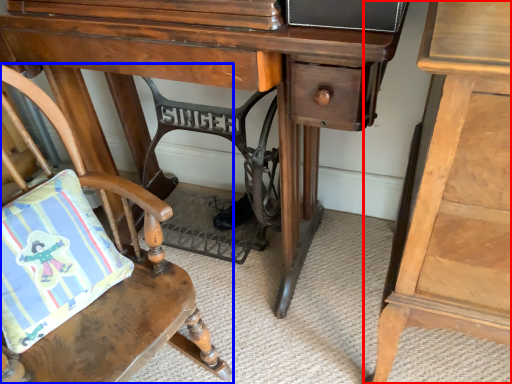
Question: Which object is further to the camera taking this photo, nightstand (highlighted by a red box) or chair (highlighted by a blue box)?

Choices:
 (A) nightstand
 (B) chair

Answer: (B)